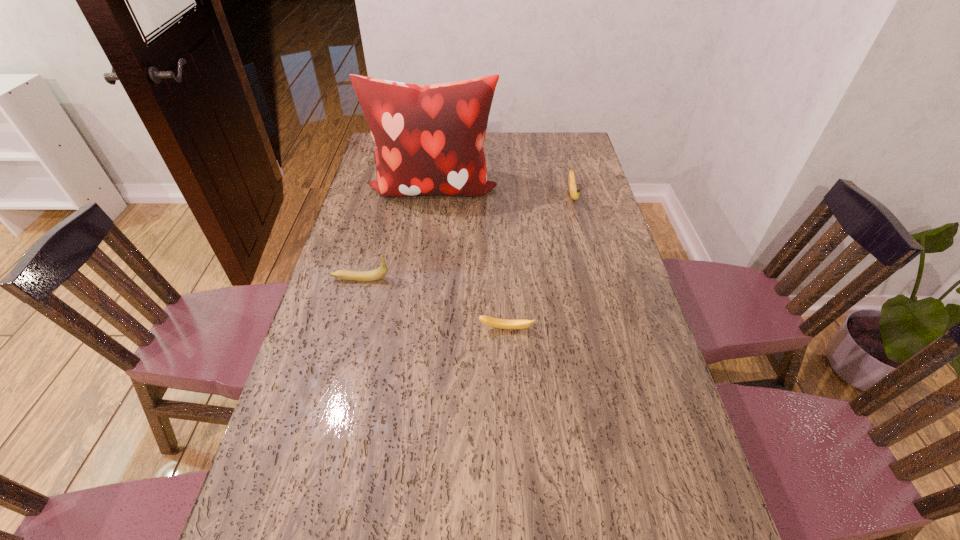
Locate an element on the screen. Image resolution: width=960 pixels, height=540 pixels. empty space between the leftmost banana and the farthest banana is located at coordinates (467, 237).

Identify the location of vacant space that's between the second nearest object and the tallest object. Image resolution: width=960 pixels, height=540 pixels. (x=396, y=234).

Locate an element on the screen. vacant space in between the cushion and the leftmost banana is located at coordinates (396, 234).

Identify the location of free space between the second nearest object and the second banana from left to right. The image size is (960, 540). (434, 304).

Image resolution: width=960 pixels, height=540 pixels. In order to click on blank region between the second shortest banana and the third farthest object in this screenshot , I will do `click(467, 237)`.

In order to click on blank region between the shortest banana and the second tallest banana in this screenshot , I will do `click(540, 262)`.

Identify the location of object that is the third closest to the shortest object. This screenshot has width=960, height=540. (574, 192).

Select which object is the closest to the second shortest banana. Please provide its 2D coordinates. Your answer should be formatted as a tuple, i.e. [(x, y)], where the tuple contains the x and y coordinates of a point satisfying the conditions above.

[(429, 139)]

Where is `banana that is the second nearest to the second shortest banana`? banana that is the second nearest to the second shortest banana is located at coordinates (363, 276).

Identify the location of banana that can be found as the closest to the third tallest object. (487, 320).